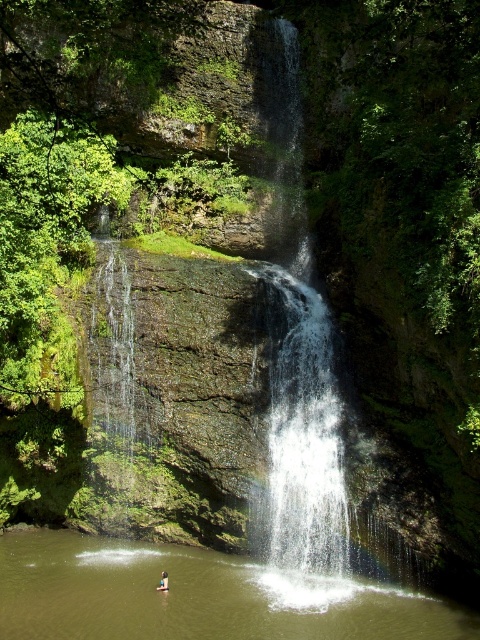
Question: Which point is closer to the camera?

Choices:
 (A) brown liquid water at center
 (B) light brown wooden stick at lower center
 (C) clear water at center

Answer: (A)

Question: Where is clear water at center located in relation to light brown wooden stick at lower center in the image?

Choices:
 (A) left
 (B) right

Answer: (B)

Question: Based on their relative distances, which object is farther from the clear water at center?

Choices:
 (A) brown liquid water at center
 (B) light brown wooden stick at lower center

Answer: (B)

Question: Which is nearer to the light brown wooden stick at lower center?

Choices:
 (A) clear water at center
 (B) brown liquid water at center

Answer: (B)

Question: Is clear water at center thinner than light brown wooden stick at lower center?

Choices:
 (A) yes
 (B) no

Answer: (B)

Question: Is clear water at center smaller than light brown wooden stick at lower center?

Choices:
 (A) no
 (B) yes

Answer: (A)